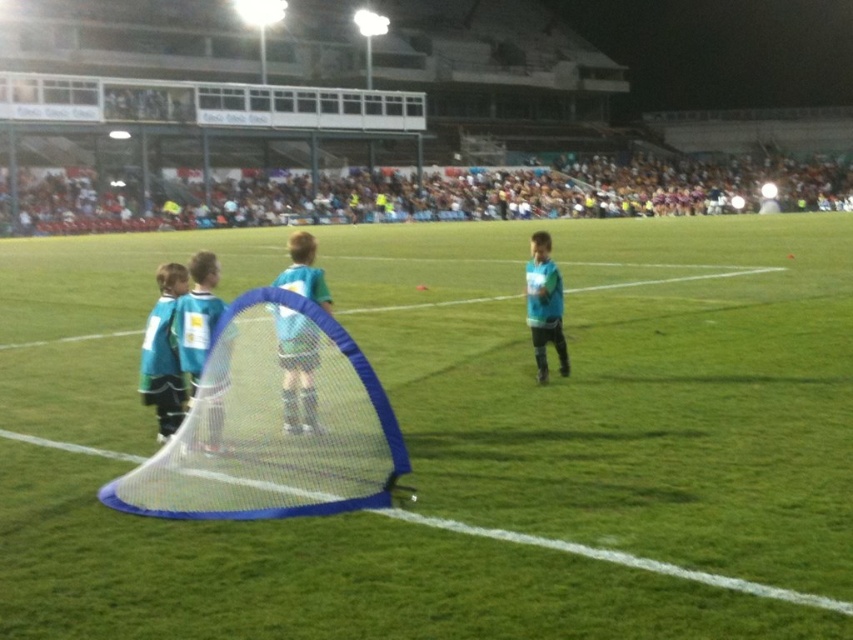
Who is higher up, blue net at center or light blue jersey at right?

blue net at center

Is blue net at center positioned before light blue jersey at right?

Yes, it is.

Does point (587, 364) come closer to viewer compared to point (550, 307)?

No, it is not.

Find the location of a particular element. This screenshot has height=640, width=853. blue net at center is located at coordinates click(x=463, y=436).

Can you confirm if blue net at center is thinner than blue matte jersey at center?

No.

Can you confirm if blue net at center is positioned below blue matte jersey at center?

No, blue net at center is not below blue matte jersey at center.

Is point (670, 390) behind point (223, 342)?

Yes, it is behind point (223, 342).

The height and width of the screenshot is (640, 853). What are the coordinates of `blue net at center` in the screenshot? It's located at (463, 436).

Who is positioned more to the left, light blue jersey at center or light blue jersey at right?

light blue jersey at center is more to the left.

At what (x,y) coordinates should I click in order to perform the action: click on light blue jersey at center. Please return your answer as a coordinate pair (x, y). The image size is (853, 640). Looking at the image, I should click on (297, 369).

The image size is (853, 640). Describe the element at coordinates (297, 369) in the screenshot. I see `light blue jersey at center` at that location.

Find the location of a particular element. The width and height of the screenshot is (853, 640). light blue jersey at center is located at coordinates 297,369.